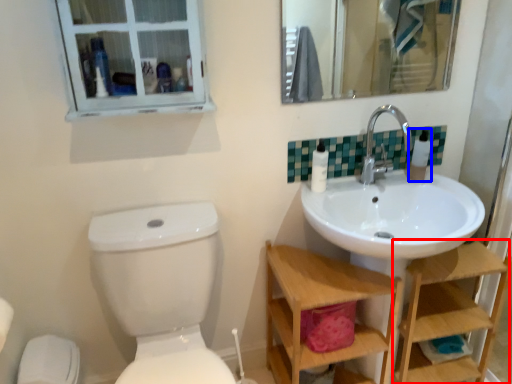
Question: Which of the following is the closest to the observer, shelf (highlighted by a red box) or toiletry (highlighted by a blue box)?

Choices:
 (A) shelf
 (B) toiletry

Answer: (A)